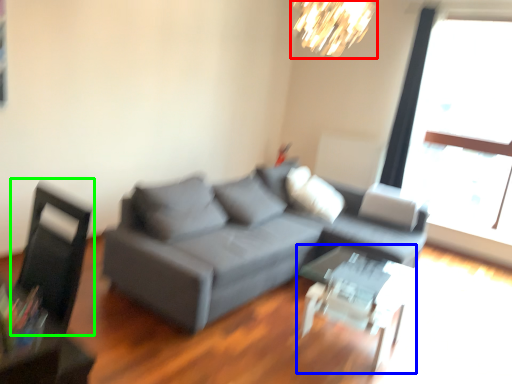
Question: Which object is positioned farthest from lamp (highlighted by a red box)? Select from table (highlighted by a blue box) and swivel chair (highlighted by a green box).

Choices:
 (A) table
 (B) swivel chair

Answer: (B)